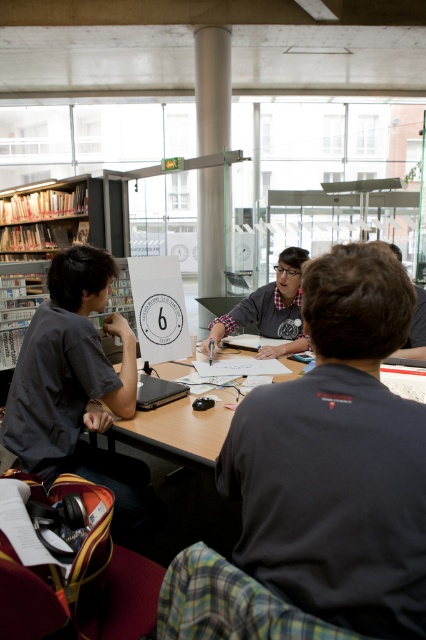
Question: Which object appears farthest from the camera in this image?

Choices:
 (A) dark gray shirt at left
 (B) satin silver pole at center
 (C) matte gray shirt at center

Answer: (B)

Question: Which point is farther to the camera?

Choices:
 (A) dark gray shirt at left
 (B) satin silver pole at center
 (C) matte gray shirt at center
 (D) matte black laptop at center

Answer: (B)

Question: Is wooden table at center further to camera compared to matte black laptop at center?

Choices:
 (A) yes
 (B) no

Answer: (B)

Question: Is dark gray shirt at left closer to camera compared to matte black laptop at center?

Choices:
 (A) no
 (B) yes

Answer: (B)

Question: Which of the following is the closest to the observer?

Choices:
 (A) (141, 380)
 (B) (262, 472)
 (C) (221, 32)
 (D) (22, 209)

Answer: (B)

Question: Can you confirm if wooden table at center is smaller than matte black laptop at center?

Choices:
 (A) yes
 (B) no

Answer: (B)